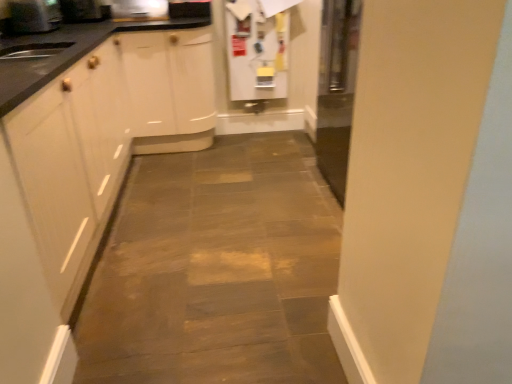
What do you see at coordinates (84, 11) in the screenshot?
I see `metallic stainless steel microwave at upper left, marked as the second appliance in a left-to-right arrangement` at bounding box center [84, 11].

How much space does white matte refrigerator at upper center, marked as the 4th appliance in a left-to-right arrangement, occupy horizontally?

It is 3.26 inches.

Where is `metallic stainless steel microwave at upper left, marked as the second appliance in a left-to-right arrangement`? Image resolution: width=512 pixels, height=384 pixels. metallic stainless steel microwave at upper left, marked as the second appliance in a left-to-right arrangement is located at coordinates (84, 11).

Is white matte refrigerator at upper center, marked as the 4th appliance in a left-to-right arrangement, beside metallic stainless steel microwave at upper left, acting as the 3th appliance starting from the right?

No, white matte refrigerator at upper center, marked as the 4th appliance in a left-to-right arrangement, is not touching metallic stainless steel microwave at upper left, acting as the 3th appliance starting from the right.

Which object is wider, white matte refrigerator at upper center, the 1th appliance viewed from the right, or metallic stainless steel microwave at upper left, acting as the 3th appliance starting from the right?

Wider between the two is metallic stainless steel microwave at upper left, acting as the 3th appliance starting from the right.

Identify the location of appliance that is the 2nd one when counting leftward from the white matte refrigerator at upper center, marked as the 4th appliance in a left-to-right arrangement. (84, 11).

Looking at this image, is white matte refrigerator at upper center, marked as the 4th appliance in a left-to-right arrangement, positioned with its back to metallic stainless steel microwave at upper left, acting as the 3th appliance starting from the right?

No, white matte refrigerator at upper center, marked as the 4th appliance in a left-to-right arrangement, is not facing away from metallic stainless steel microwave at upper left, acting as the 3th appliance starting from the right.

Based on the photo, are metallic stainless steel microwave at upper left, acting as the 3th appliance starting from the right, and metallic stainless steel microwave at upper center, which appears as the 3th appliance when viewed from the left, beside each other?

No, metallic stainless steel microwave at upper left, acting as the 3th appliance starting from the right, is not making contact with metallic stainless steel microwave at upper center, which appears as the 3th appliance when viewed from the left.

Can you confirm if metallic stainless steel microwave at upper left, acting as the 3th appliance starting from the right, is shorter than metallic stainless steel microwave at upper center, which appears as the 3th appliance when viewed from the left?

Yes.

Which object is wider, metallic stainless steel microwave at upper left, acting as the 3th appliance starting from the right, or metallic stainless steel microwave at upper center, the 2th appliance positioned from the right?

With larger width is metallic stainless steel microwave at upper left, acting as the 3th appliance starting from the right.

Which is more to the left, metallic stainless steel microwave at upper left, acting as the 3th appliance starting from the right, or white matte refrigerator at upper center, marked as the 4th appliance in a left-to-right arrangement?

metallic stainless steel microwave at upper left, acting as the 3th appliance starting from the right, is more to the left.

Are metallic stainless steel microwave at upper left, marked as the second appliance in a left-to-right arrangement, and white matte refrigerator at upper center, marked as the 4th appliance in a left-to-right arrangement, beside each other?

metallic stainless steel microwave at upper left, marked as the second appliance in a left-to-right arrangement, is not next to white matte refrigerator at upper center, marked as the 4th appliance in a left-to-right arrangement, and they're not touching.

Is metallic stainless steel microwave at upper left, acting as the 3th appliance starting from the right, turned away from white matte refrigerator at upper center, marked as the 4th appliance in a left-to-right arrangement?

metallic stainless steel microwave at upper left, acting as the 3th appliance starting from the right, is not turned away from white matte refrigerator at upper center, marked as the 4th appliance in a left-to-right arrangement.

Consider the image. From a real-world perspective, between metallic stainless steel microwave at upper left, marked as the second appliance in a left-to-right arrangement, and white matte refrigerator at upper center, the 1th appliance viewed from the right, who is vertically lower?

white matte refrigerator at upper center, the 1th appliance viewed from the right, from a real-world perspective.

In the scene shown: Can you confirm if white matte refrigerator at upper center, marked as the 4th appliance in a left-to-right arrangement, is smaller than metallic stainless steel microwave at upper center, the 2th appliance positioned from the right?

Incorrect, white matte refrigerator at upper center, marked as the 4th appliance in a left-to-right arrangement, is not smaller in size than metallic stainless steel microwave at upper center, the 2th appliance positioned from the right.

From the image's perspective, which is below, white matte refrigerator at upper center, marked as the 4th appliance in a left-to-right arrangement, or metallic stainless steel microwave at upper center, which appears as the 3th appliance when viewed from the left?

white matte refrigerator at upper center, marked as the 4th appliance in a left-to-right arrangement, is shown below in the image.

Is the surface of white matte refrigerator at upper center, marked as the 4th appliance in a left-to-right arrangement, in direct contact with metallic stainless steel microwave at upper center, the 2th appliance positioned from the right?

There is a gap between white matte refrigerator at upper center, marked as the 4th appliance in a left-to-right arrangement, and metallic stainless steel microwave at upper center, the 2th appliance positioned from the right.

The image size is (512, 384). In order to click on appliance located underneath the metallic stainless steel microwave at upper center, which appears as the 3th appliance when viewed from the left (from a real-world perspective) in this screenshot , I will do `click(256, 51)`.

Can you see metallic stainless steel microwave at upper center, which appears as the 3th appliance when viewed from the left, touching metallic silver toaster at upper left, acting as the fourth appliance starting from the right?

They are not placed beside each other.

How many degrees apart are the facing directions of metallic stainless steel microwave at upper center, the 2th appliance positioned from the right, and metallic silver toaster at upper left, arranged as the first appliance when viewed from the left?

The angle between the facing direction of metallic stainless steel microwave at upper center, the 2th appliance positioned from the right, and the facing direction of metallic silver toaster at upper left, arranged as the first appliance when viewed from the left, is 88.9 degrees.

From the picture: Can you confirm if metallic stainless steel microwave at upper center, which appears as the 3th appliance when viewed from the left, is taller than metallic silver toaster at upper left, arranged as the first appliance when viewed from the left?

Incorrect, the height of metallic stainless steel microwave at upper center, which appears as the 3th appliance when viewed from the left, is not larger of that of metallic silver toaster at upper left, arranged as the first appliance when viewed from the left.

From the image's perspective, which one is positioned higher, metallic stainless steel microwave at upper center, the 2th appliance positioned from the right, or metallic silver toaster at upper left, acting as the fourth appliance starting from the right?

metallic stainless steel microwave at upper center, the 2th appliance positioned from the right, from the image's perspective.

Who is taller, white matte refrigerator at upper center, the 1th appliance viewed from the right, or metallic silver toaster at upper left, acting as the fourth appliance starting from the right?

Standing taller between the two is white matte refrigerator at upper center, the 1th appliance viewed from the right.

Which object is positioned more to the left, white matte refrigerator at upper center, marked as the 4th appliance in a left-to-right arrangement, or metallic silver toaster at upper left, arranged as the first appliance when viewed from the left?

Positioned to the left is metallic silver toaster at upper left, arranged as the first appliance when viewed from the left.

From the image's perspective, is white matte refrigerator at upper center, the 1th appliance viewed from the right, under metallic silver toaster at upper left, acting as the fourth appliance starting from the right?

Yes.

Can you tell me how much white matte refrigerator at upper center, marked as the 4th appliance in a left-to-right arrangement, and metallic silver toaster at upper left, acting as the fourth appliance starting from the right, differ in facing direction?

89.3 degrees.

Would you consider metallic silver toaster at upper left, arranged as the first appliance when viewed from the left, to be distant from metallic stainless steel microwave at upper left, marked as the second appliance in a left-to-right arrangement?

metallic silver toaster at upper left, arranged as the first appliance when viewed from the left, is actually quite close to metallic stainless steel microwave at upper left, marked as the second appliance in a left-to-right arrangement.

From their relative heights in the image, would you say metallic silver toaster at upper left, acting as the fourth appliance starting from the right, is taller or shorter than metallic stainless steel microwave at upper left, marked as the second appliance in a left-to-right arrangement?

Clearly, metallic silver toaster at upper left, acting as the fourth appliance starting from the right, is taller compared to metallic stainless steel microwave at upper left, marked as the second appliance in a left-to-right arrangement.

From the image's perspective, would you say metallic silver toaster at upper left, acting as the fourth appliance starting from the right, is positioned over metallic stainless steel microwave at upper left, acting as the 3th appliance starting from the right?

Actually, metallic silver toaster at upper left, acting as the fourth appliance starting from the right, appears below metallic stainless steel microwave at upper left, acting as the 3th appliance starting from the right, in the image.

How many degrees apart are the facing directions of metallic silver toaster at upper left, arranged as the first appliance when viewed from the left, and metallic stainless steel microwave at upper left, marked as the second appliance in a left-to-right arrangement?

There is a 89.8-degree angle between the facing directions of metallic silver toaster at upper left, arranged as the first appliance when viewed from the left, and metallic stainless steel microwave at upper left, marked as the second appliance in a left-to-right arrangement.

Identify the location of the 2nd appliance in front of the white matte refrigerator at upper center, marked as the 4th appliance in a left-to-right arrangement, counting from the anchor's position. (84, 11).

Where is `the 1st appliance located beneath the metallic stainless steel microwave at upper left, acting as the 3th appliance starting from the right (from a real-world perspective)`? This screenshot has height=384, width=512. the 1st appliance located beneath the metallic stainless steel microwave at upper left, acting as the 3th appliance starting from the right (from a real-world perspective) is located at coordinates click(x=138, y=10).

Based on the photo, based on their spatial positions, is metallic stainless steel microwave at upper left, marked as the second appliance in a left-to-right arrangement, or metallic stainless steel microwave at upper center, which appears as the 3th appliance when viewed from the left, further from metallic silver toaster at upper left, acting as the fourth appliance starting from the right?

Among the two, metallic stainless steel microwave at upper center, which appears as the 3th appliance when viewed from the left, is located further to metallic silver toaster at upper left, acting as the fourth appliance starting from the right.

When comparing their distances from white matte refrigerator at upper center, marked as the 4th appliance in a left-to-right arrangement, does metallic stainless steel microwave at upper center, which appears as the 3th appliance when viewed from the left, or metallic stainless steel microwave at upper left, marked as the second appliance in a left-to-right arrangement, seem closer?

The object closer to white matte refrigerator at upper center, marked as the 4th appliance in a left-to-right arrangement, is metallic stainless steel microwave at upper center, which appears as the 3th appliance when viewed from the left.

Consider the image. Considering their positions, is metallic stainless steel microwave at upper left, marked as the second appliance in a left-to-right arrangement, positioned further to metallic silver toaster at upper left, arranged as the first appliance when viewed from the left, than white matte refrigerator at upper center, the 1th appliance viewed from the right?

Among the two, white matte refrigerator at upper center, the 1th appliance viewed from the right, is located further to metallic silver toaster at upper left, arranged as the first appliance when viewed from the left.

Estimate the real-world distances between objects in this image. Which object is further from metallic stainless steel microwave at upper center, which appears as the 3th appliance when viewed from the left, metallic stainless steel microwave at upper left, marked as the second appliance in a left-to-right arrangement, or metallic silver toaster at upper left, acting as the fourth appliance starting from the right?

metallic silver toaster at upper left, acting as the fourth appliance starting from the right, is positioned further to the anchor metallic stainless steel microwave at upper center, which appears as the 3th appliance when viewed from the left.

Which object lies further to the anchor point white matte refrigerator at upper center, marked as the 4th appliance in a left-to-right arrangement, metallic silver toaster at upper left, arranged as the first appliance when viewed from the left, or metallic stainless steel microwave at upper center, the 2th appliance positioned from the right?

metallic silver toaster at upper left, arranged as the first appliance when viewed from the left, is further to white matte refrigerator at upper center, marked as the 4th appliance in a left-to-right arrangement.

Considering their positions, is metallic stainless steel microwave at upper left, marked as the second appliance in a left-to-right arrangement, positioned further to metallic stainless steel microwave at upper center, the 2th appliance positioned from the right, than white matte refrigerator at upper center, marked as the 4th appliance in a left-to-right arrangement?

Among the two, white matte refrigerator at upper center, marked as the 4th appliance in a left-to-right arrangement, is located further to metallic stainless steel microwave at upper center, the 2th appliance positioned from the right.

Considering their positions, is metallic stainless steel microwave at upper center, the 2th appliance positioned from the right, positioned further to white matte refrigerator at upper center, marked as the 4th appliance in a left-to-right arrangement, than metallic silver toaster at upper left, arranged as the first appliance when viewed from the left?

Based on the image, metallic silver toaster at upper left, arranged as the first appliance when viewed from the left, appears to be further to white matte refrigerator at upper center, marked as the 4th appliance in a left-to-right arrangement.

Consider the image. Considering their positions, is metallic silver toaster at upper left, arranged as the first appliance when viewed from the left, positioned closer to metallic stainless steel microwave at upper center, which appears as the 3th appliance when viewed from the left, than white matte refrigerator at upper center, the 1th appliance viewed from the right?

Among the two, metallic silver toaster at upper left, arranged as the first appliance when viewed from the left, is located nearer to metallic stainless steel microwave at upper center, which appears as the 3th appliance when viewed from the left.

Find the location of a particular element. This screenshot has height=384, width=512. appliance between metallic silver toaster at upper left, arranged as the first appliance when viewed from the left, and metallic stainless steel microwave at upper center, the 2th appliance positioned from the right, in the front-back direction is located at coordinates (84, 11).

Find the location of a particular element. The image size is (512, 384). appliance between metallic stainless steel microwave at upper left, marked as the second appliance in a left-to-right arrangement, and white matte refrigerator at upper center, marked as the 4th appliance in a left-to-right arrangement is located at coordinates (138, 10).